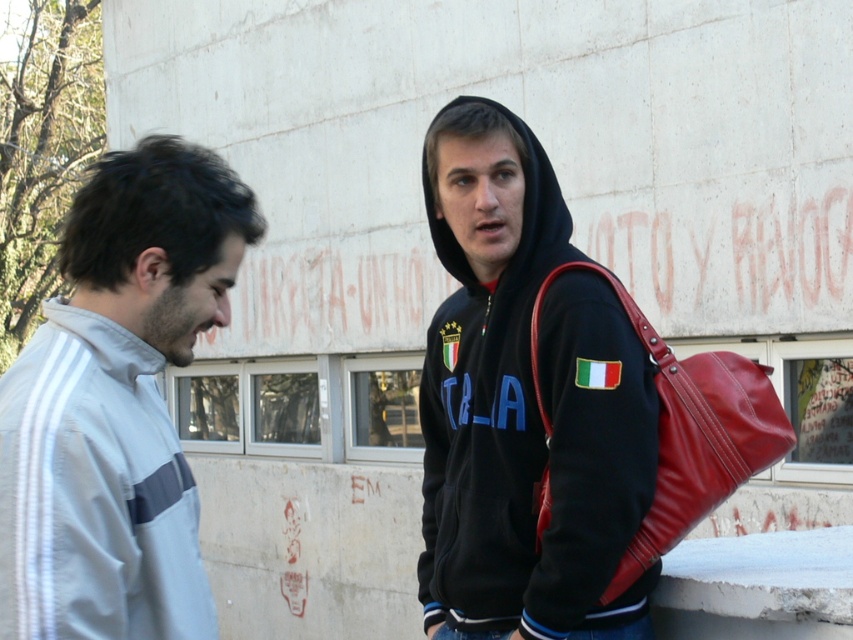
Question: Can you confirm if black fleece hoodie at center is positioned to the right of light gray fabric jacket at left?

Choices:
 (A) yes
 (B) no

Answer: (A)

Question: Considering the real-world distances, which object is farthest from the leather-like red bag at right?

Choices:
 (A) black fleece hoodie at center
 (B) light gray fabric jacket at left

Answer: (B)

Question: Which object is farther from the camera taking this photo?

Choices:
 (A) black fleece hoodie at center
 (B) leather-like red bag at right

Answer: (B)

Question: Does light gray fabric jacket at left appear on the right side of leather-like red bag at right?

Choices:
 (A) yes
 (B) no

Answer: (B)

Question: Which of the following is the closest to the observer?

Choices:
 (A) (235, 257)
 (B) (601, 413)
 (C) (706, 445)

Answer: (A)

Question: From the image, what is the correct spatial relationship of black fleece hoodie at center in relation to light gray fabric jacket at left?

Choices:
 (A) above
 (B) below

Answer: (A)